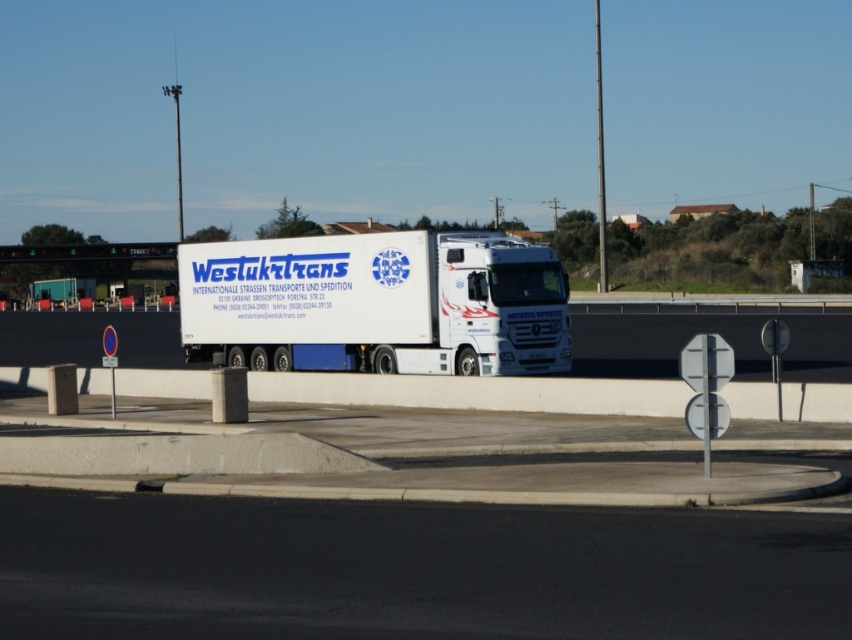
Question: Which point appears closest to the camera in this image?

Choices:
 (A) (505, 353)
 (B) (67, 244)
 (C) (21, 346)

Answer: (A)

Question: Is white glossy trailer truck at center closer to camera compared to white glossy truck at center?

Choices:
 (A) yes
 (B) no

Answer: (B)

Question: Which object is positioned closest to the green electronic sign at upper center?

Choices:
 (A) white glossy trailer truck at center
 (B) white glossy truck at center

Answer: (B)

Question: Which object is closer to the camera taking this photo?

Choices:
 (A) white glossy trailer truck at center
 (B) green electronic sign at upper center
 (C) white glossy truck at center

Answer: (C)

Question: Does white glossy trailer truck at center have a greater width compared to white glossy truck at center?

Choices:
 (A) yes
 (B) no

Answer: (B)

Question: Can you confirm if white glossy trailer truck at center is wider than green electronic sign at upper center?

Choices:
 (A) yes
 (B) no

Answer: (B)